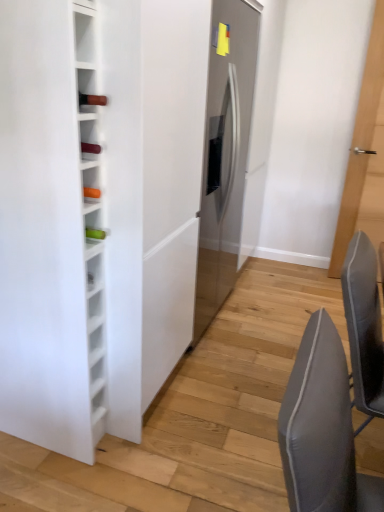
Question: Can you confirm if white glass wine rack at left is bigger than satin silver refrigerator at center?

Choices:
 (A) no
 (B) yes

Answer: (A)

Question: From a real-world perspective, is white glass wine rack at left physically below satin silver refrigerator at center?

Choices:
 (A) no
 (B) yes

Answer: (B)

Question: Is white glass wine rack at left not near satin silver refrigerator at center?

Choices:
 (A) no
 (B) yes

Answer: (B)

Question: Does white glass wine rack at left have a lesser height compared to satin silver refrigerator at center?

Choices:
 (A) yes
 (B) no

Answer: (A)

Question: Could you tell me if white glass wine rack at left is facing satin silver refrigerator at center?

Choices:
 (A) yes
 (B) no

Answer: (B)

Question: Is white glass wine rack at left next to satin silver refrigerator at center and touching it?

Choices:
 (A) yes
 (B) no

Answer: (B)

Question: Would you say gray fabric chair at lower right contains satin silver refrigerator at center?

Choices:
 (A) yes
 (B) no

Answer: (B)

Question: Does gray fabric chair at lower right have a greater width compared to satin silver refrigerator at center?

Choices:
 (A) yes
 (B) no

Answer: (B)

Question: Is gray fabric chair at lower right positioned far away from satin silver refrigerator at center?

Choices:
 (A) no
 (B) yes

Answer: (B)

Question: From a real-world perspective, does gray fabric chair at lower right sit lower than satin silver refrigerator at center?

Choices:
 (A) no
 (B) yes

Answer: (B)

Question: Is gray fabric chair at lower right positioned with its back to satin silver refrigerator at center?

Choices:
 (A) no
 (B) yes

Answer: (A)

Question: From the image's perspective, would you say gray fabric chair at lower right is shown under satin silver refrigerator at center?

Choices:
 (A) no
 (B) yes

Answer: (B)

Question: Is white glass wine rack at left smaller than gray fabric chair at lower right?

Choices:
 (A) no
 (B) yes

Answer: (A)